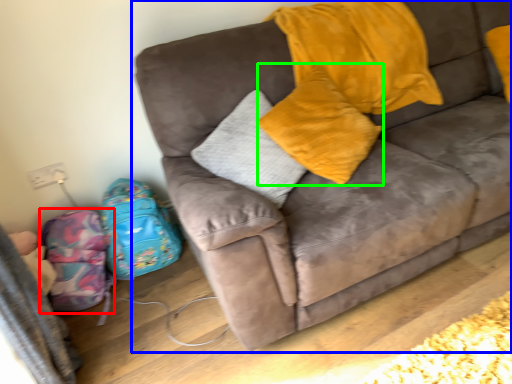
Question: Which object is the farthest from luggage (highlighted by a red box)? Choose among these: studio couch (highlighted by a blue box) or pillow (highlighted by a green box).

Choices:
 (A) studio couch
 (B) pillow

Answer: (B)